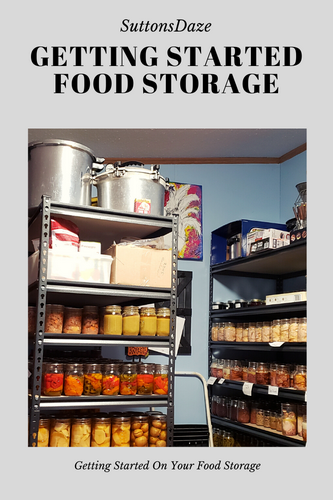
I want to click on top step of step stool, so coord(189,433).